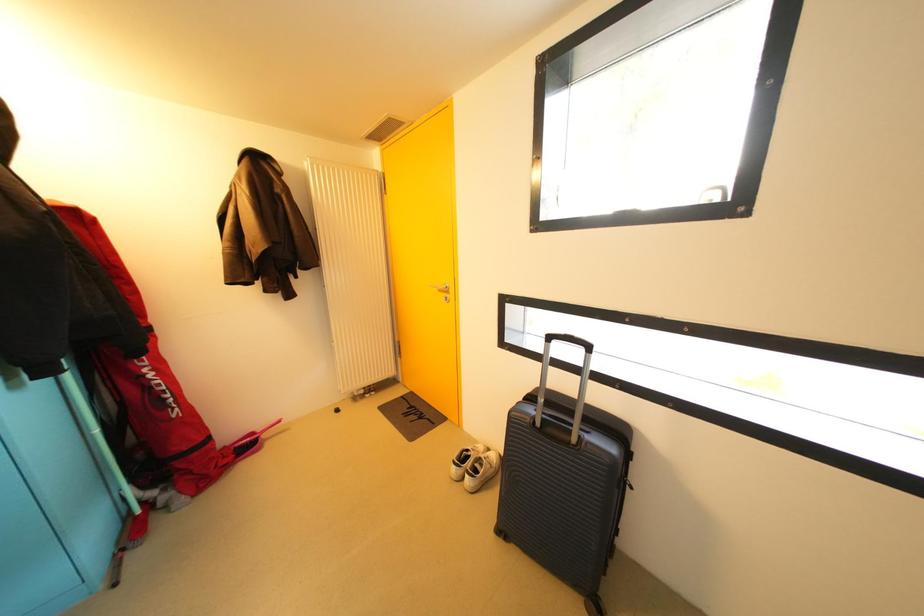
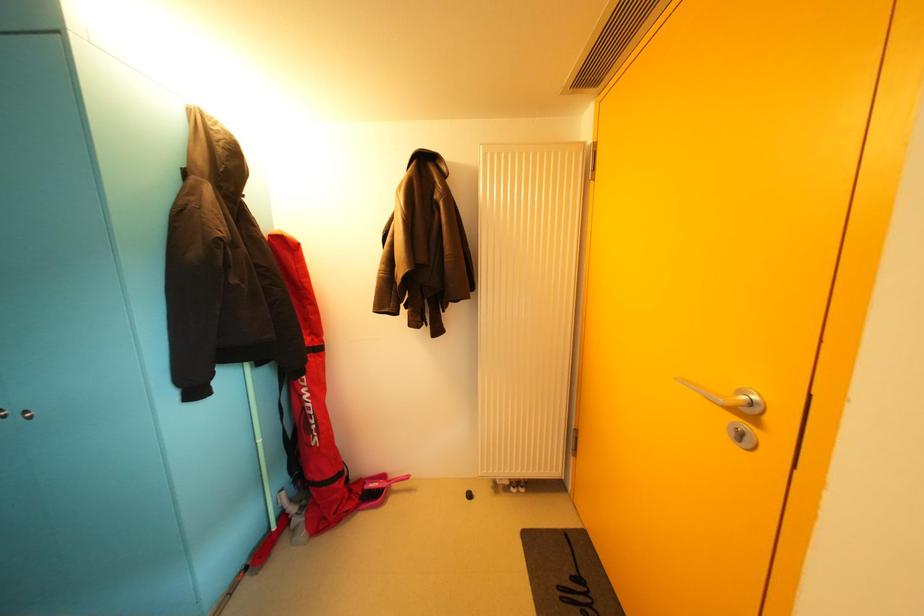
Question: The images are taken continuously from a first-person perspective. In which direction is your viewpoint rotating?

Choices:
 (A) Left
 (B) Right
 (C) Up
 (D) Down

Answer: (A)